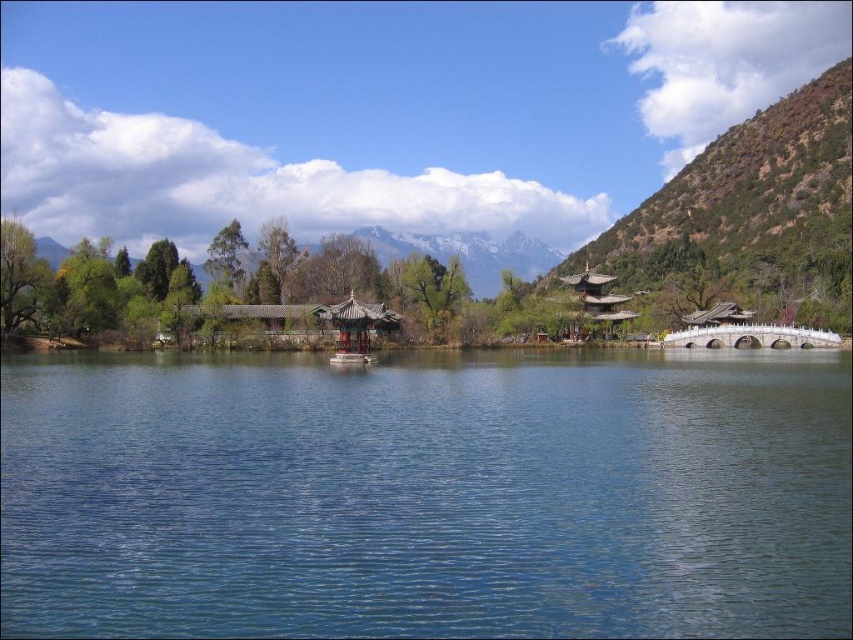
You are standing on the stone bridge and want to take a photo of both the transparent blue water at center and the green textured mountain at upper right. Which object should you point your camera towards first to include both in the frame?

You should point your camera towards the green textured mountain at upper right first because it is above the transparent blue water at center, so capturing it first ensures both are in the frame.

You are standing at the shore of the transparent blue water at center and want to reach the green textured mountain at upper right. Which direction should you walk to get closer to the mountain?

Since the transparent blue water at center is closer to the viewer than the green textured mountain at upper right, you should walk towards the upper right direction to get closer to the mountain.